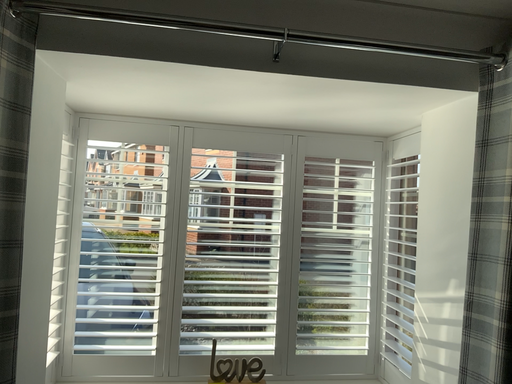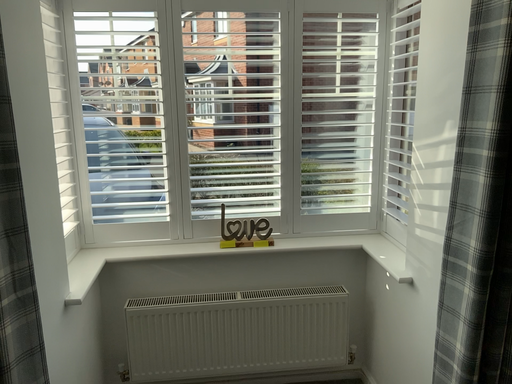
Question: Which way did the camera rotate in the video?

Choices:
 (A) rotated upward
 (B) rotated downward

Answer: (B)